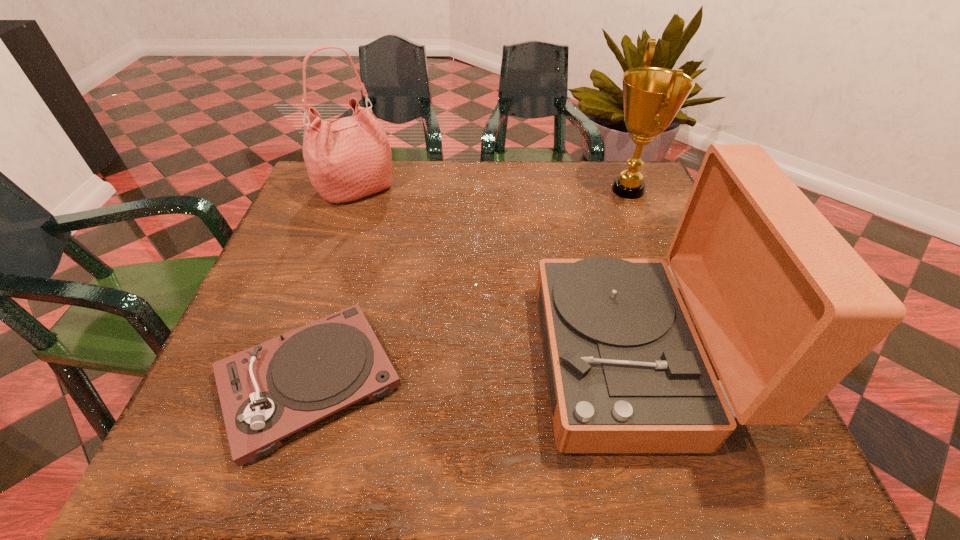
Image resolution: width=960 pixels, height=540 pixels. In order to click on vacant space positioned on the face of the right phonograph_record in this screenshot , I will do `click(382, 359)`.

Where is `free location located on the face of the right phonograph_record`? The image size is (960, 540). free location located on the face of the right phonograph_record is located at coordinates (416, 359).

At what (x,y) coordinates should I click in order to perform the action: click on free point located on the right of the left phonograph_record. Please return your answer as a coordinate pair (x, y). This screenshot has height=540, width=960. Looking at the image, I should click on (444, 381).

The width and height of the screenshot is (960, 540). What are the coordinates of `handbag positioned at the far edge` in the screenshot? It's located at (348, 158).

Locate an element on the screen. award located at the far edge is located at coordinates (652, 96).

Identify the location of handbag located at the left edge. The height and width of the screenshot is (540, 960). (348, 158).

Where is `phonograph_record present at the left edge`? The image size is (960, 540). phonograph_record present at the left edge is located at coordinates (270, 391).

Where is `award that is at the right edge`? Image resolution: width=960 pixels, height=540 pixels. award that is at the right edge is located at coordinates (652, 96).

Locate an element on the screen. phonograph record situated at the right edge is located at coordinates (786, 308).

Locate an element on the screen. This screenshot has height=540, width=960. object present at the far left corner is located at coordinates (348, 158).